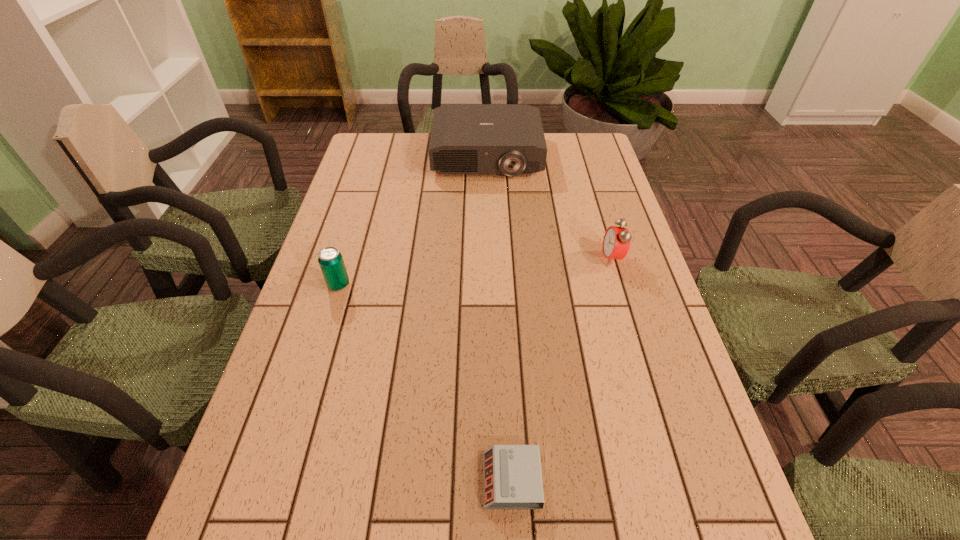
Identify the location of free point between the projector and the third farthest object. This screenshot has width=960, height=540. pyautogui.click(x=413, y=220).

Locate an element on the screen. free space between the beer can and the farther alarm clock is located at coordinates (475, 272).

In order to click on vacant space that's between the third farthest object and the second farthest object in this screenshot , I will do `click(475, 272)`.

Where is `free space between the projector and the shortest object`? Image resolution: width=960 pixels, height=540 pixels. free space between the projector and the shortest object is located at coordinates (499, 318).

Identify the location of free space between the projector and the left alarm clock. Image resolution: width=960 pixels, height=540 pixels. (499, 318).

This screenshot has height=540, width=960. Identify the location of unoccupied area between the right alarm clock and the shortest object. (562, 369).

Image resolution: width=960 pixels, height=540 pixels. In order to click on empty space that is in between the leftmost object and the shorter alarm clock in this screenshot , I will do `click(425, 382)`.

Where is `vacant area between the projector and the second nearest object`? The width and height of the screenshot is (960, 540). vacant area between the projector and the second nearest object is located at coordinates (413, 220).

Identify the location of blank region between the taller alarm clock and the nearest object. The height and width of the screenshot is (540, 960). (562, 369).

The width and height of the screenshot is (960, 540). Find the location of `object that is the third closest to the nearer alarm clock`. object that is the third closest to the nearer alarm clock is located at coordinates (508, 139).